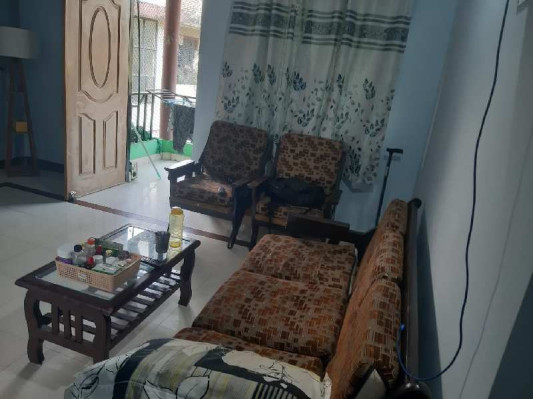
The height and width of the screenshot is (399, 533). What are the coordinates of `light blue wall` in the screenshot? It's located at (52, 82), (415, 94), (506, 164), (513, 381).